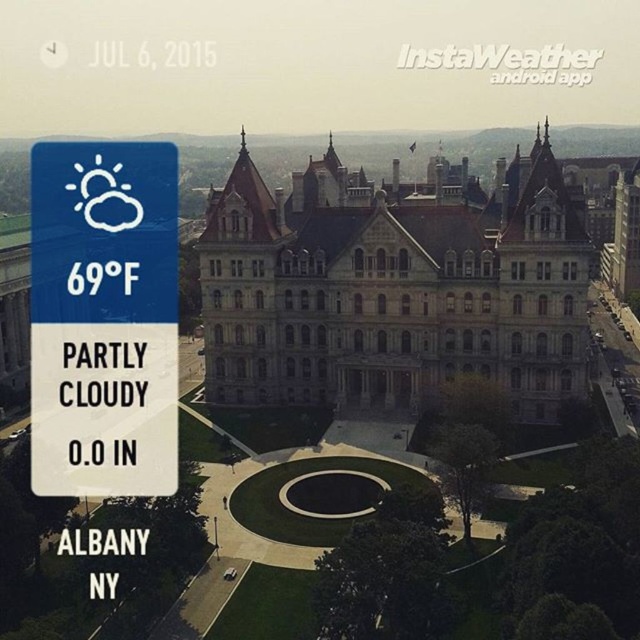
Question: In this image, where is stone/brick palace at center located relative to blue plastic weather icon at upper left?

Choices:
 (A) below
 (B) above

Answer: (B)

Question: Does stone/brick palace at center come in front of blue plastic weather icon at upper left?

Choices:
 (A) no
 (B) yes

Answer: (A)

Question: Which point is closer to the camera?

Choices:
 (A) (237, 257)
 (B) (97, 493)

Answer: (B)

Question: Where is stone/brick palace at center located in relation to blue plastic weather icon at upper left in the image?

Choices:
 (A) above
 (B) below

Answer: (A)